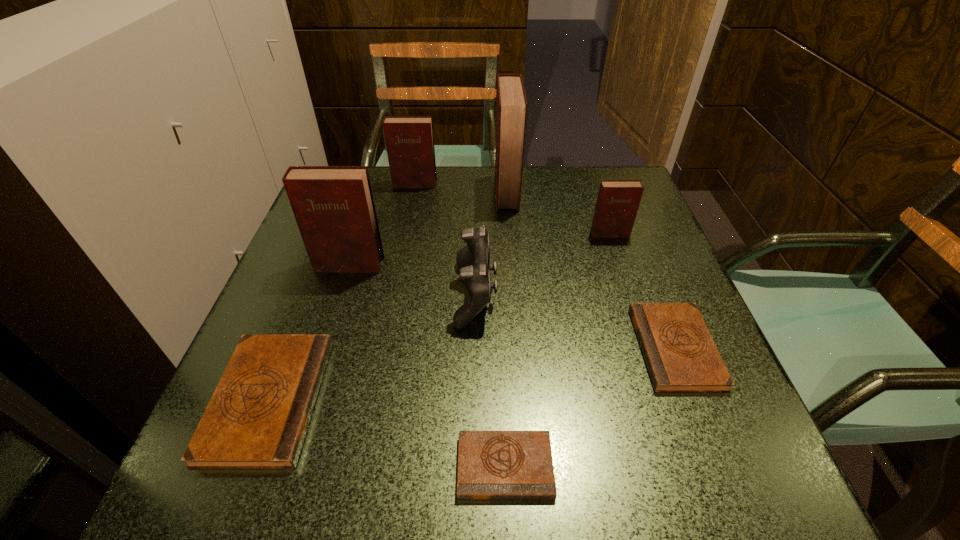
Find the location of a particular element. The height and width of the screenshot is (540, 960). vacant position at the right edge of the desktop is located at coordinates (606, 273).

I want to click on free space at the near left corner, so click(x=274, y=470).

This screenshot has width=960, height=540. In the image, there is a desktop. Identify the location of vacant space at the far right corner. [594, 205].

The height and width of the screenshot is (540, 960). I want to click on free space at the near right corner of the desktop, so click(694, 480).

Find the location of a particular element. The image size is (960, 540). vacant area that lies between the third biggest reddish-brown diary and the rightmost brown diary is located at coordinates (545, 266).

I want to click on free area in between the fifth nearest diary and the third tallest diary, so click(x=512, y=209).

Locate an element on the screen. free space between the biggest reddish-brown diary and the third tallest object is located at coordinates (461, 188).

Identify the location of unoccupied position between the tallest diary and the shortest diary. (506, 329).

Identify the location of vacant point located between the fourth farthest diary and the third tallest object. This screenshot has width=960, height=540. (382, 225).

This screenshot has width=960, height=540. I want to click on vacant area that lies between the second shortest object and the sixth shortest object, so click(x=545, y=266).